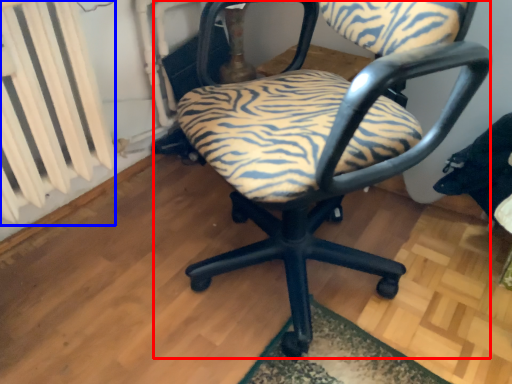
Question: Which object is closer to the camera taking this photo, chair (highlighted by a red box) or radiator (highlighted by a blue box)?

Choices:
 (A) chair
 (B) radiator

Answer: (A)